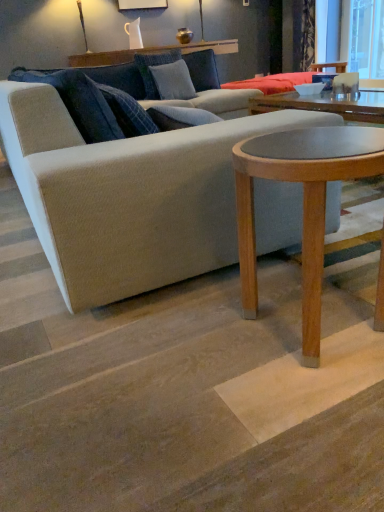
Identify the location of free spot to the left of light brown wood coffee table at center. The image size is (384, 512). (179, 345).